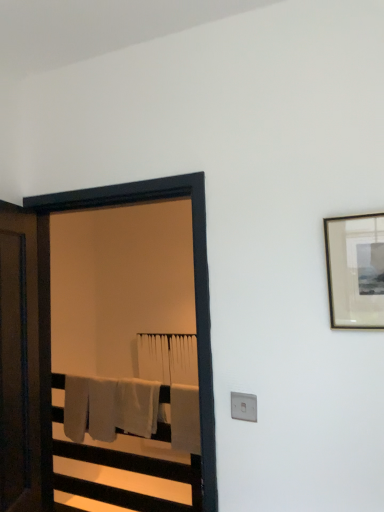
Question: In which direction should I rotate to look at white cotton bath towel at center, arranged as the first bath towel when viewed from the back?

Choices:
 (A) left
 (B) right

Answer: (A)

Question: Would you say white plastic electric outlet at lower center is part of matte black picture frame at upper right's contents?

Choices:
 (A) yes
 (B) no

Answer: (B)

Question: From the image's perspective, is matte black picture frame at upper right below white plastic electric outlet at lower center?

Choices:
 (A) yes
 (B) no

Answer: (B)

Question: Is matte black picture frame at upper right positioned before white plastic electric outlet at lower center?

Choices:
 (A) no
 (B) yes

Answer: (B)

Question: Is matte black picture frame at upper right to the right of white plastic electric outlet at lower center from the viewer's perspective?

Choices:
 (A) no
 (B) yes

Answer: (B)

Question: From a real-world perspective, is matte black picture frame at upper right over white plastic electric outlet at lower center?

Choices:
 (A) yes
 (B) no

Answer: (A)

Question: Can you confirm if matte black picture frame at upper right is thinner than white plastic electric outlet at lower center?

Choices:
 (A) no
 (B) yes

Answer: (A)

Question: Is white plastic electric outlet at lower center oriented away from white cotton bath towel at center, which is the 3th bath towel from back to front?

Choices:
 (A) yes
 (B) no

Answer: (B)

Question: Considering the relative sizes of white plastic electric outlet at lower center and white cotton bath towel at center, which ranks as the first bath towel in front-to-back order, in the image provided, is white plastic electric outlet at lower center thinner than white cotton bath towel at center, which ranks as the first bath towel in front-to-back order,?

Choices:
 (A) yes
 (B) no

Answer: (A)

Question: Considering the relative sizes of white plastic electric outlet at lower center and white cotton bath towel at center, which is the 3th bath towel from back to front, in the image provided, is white plastic electric outlet at lower center smaller than white cotton bath towel at center, which is the 3th bath towel from back to front,?

Choices:
 (A) no
 (B) yes

Answer: (B)

Question: Can you confirm if white plastic electric outlet at lower center is bigger than white cotton bath towel at center, which ranks as the first bath towel in front-to-back order?

Choices:
 (A) no
 (B) yes

Answer: (A)

Question: Is white plastic electric outlet at lower center not within white cotton bath towel at center, which is the 3th bath towel from back to front?

Choices:
 (A) no
 (B) yes

Answer: (B)

Question: Can you confirm if white plastic electric outlet at lower center is positioned to the left of white cotton bath towel at center, which ranks as the first bath towel in front-to-back order?

Choices:
 (A) yes
 (B) no

Answer: (B)

Question: Does matte black picture frame at upper right appear on the right side of white soft bath towel at center, which ranks as the second bath towel in front-to-back order?

Choices:
 (A) yes
 (B) no

Answer: (A)